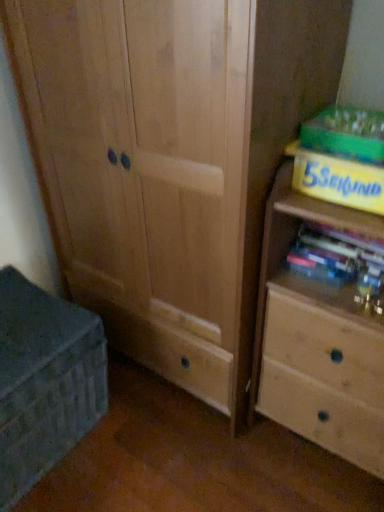
Question: Does yellow cardboard book at upper right, which is the 2th paperback book from bottom to top, have a larger size compared to matte gray chest at lower left?

Choices:
 (A) no
 (B) yes

Answer: (A)

Question: Is yellow cardboard book at upper right, the first paperback book when ordered from top to bottom, completely or partially outside of matte gray chest at lower left?

Choices:
 (A) yes
 (B) no

Answer: (A)

Question: Can you confirm if yellow cardboard book at upper right, the first paperback book when ordered from top to bottom, is taller than matte gray chest at lower left?

Choices:
 (A) yes
 (B) no

Answer: (B)

Question: From the image's perspective, is yellow cardboard book at upper right, the first paperback book when ordered from top to bottom, on top of matte gray chest at lower left?

Choices:
 (A) no
 (B) yes

Answer: (B)

Question: From a real-world perspective, does yellow cardboard book at upper right, which is the 2th paperback book from bottom to top, stand above matte gray chest at lower left?

Choices:
 (A) no
 (B) yes

Answer: (B)

Question: Does yellow cardboard book at upper right, the first paperback book when ordered from top to bottom, have a lesser width compared to matte gray chest at lower left?

Choices:
 (A) yes
 (B) no

Answer: (A)

Question: Is light wood chest of drawers at right a part of matte gray chest at lower left?

Choices:
 (A) yes
 (B) no

Answer: (B)

Question: Considering the relative positions of matte gray chest at lower left and light wood chest of drawers at right in the image provided, is matte gray chest at lower left to the left of light wood chest of drawers at right from the viewer's perspective?

Choices:
 (A) no
 (B) yes

Answer: (B)

Question: From a real-world perspective, is matte gray chest at lower left on light wood chest of drawers at right?

Choices:
 (A) yes
 (B) no

Answer: (B)

Question: From a real-world perspective, is matte gray chest at lower left positioned under light wood chest of drawers at right based on gravity?

Choices:
 (A) no
 (B) yes

Answer: (B)

Question: Does matte gray chest at lower left have a greater height compared to light wood chest of drawers at right?

Choices:
 (A) yes
 (B) no

Answer: (B)

Question: Considering the relative sizes of matte gray chest at lower left and light wood chest of drawers at right in the image provided, is matte gray chest at lower left thinner than light wood chest of drawers at right?

Choices:
 (A) no
 (B) yes

Answer: (A)

Question: Can you confirm if yellow cardboard book at upper right, which is the 2th paperback book from bottom to top, is smaller than light wood chest of drawers at right?

Choices:
 (A) no
 (B) yes

Answer: (B)